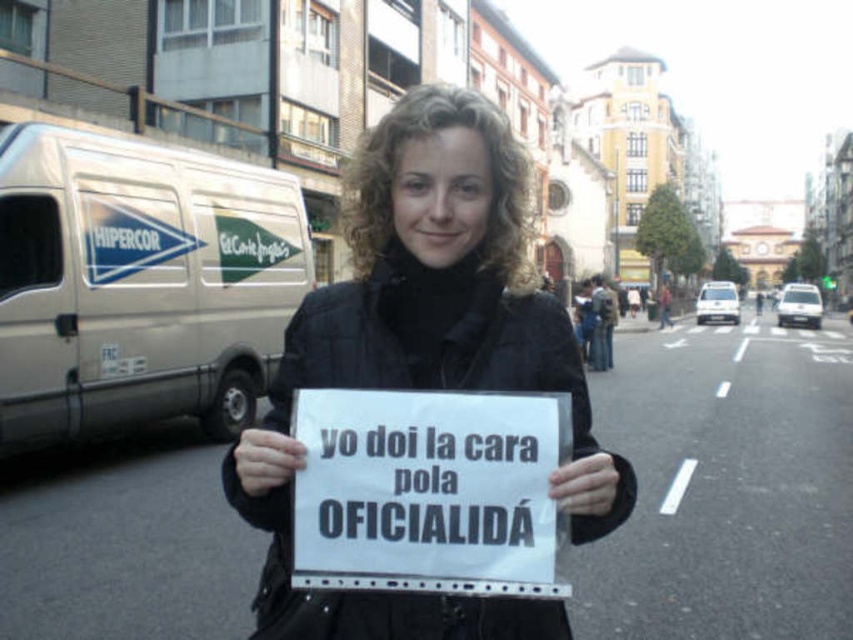
Is black matte jacket at center closer to the viewer compared to white paper sign at center?

Yes, it is.

Who is more distant from viewer, (402, 104) or (340, 465)?

The point (402, 104) is behind.

Who is more forward, (x=511, y=307) or (x=480, y=531)?

Point (x=480, y=531)

This screenshot has height=640, width=853. What are the coordinates of `black matte jacket at center` in the screenshot? It's located at (425, 356).